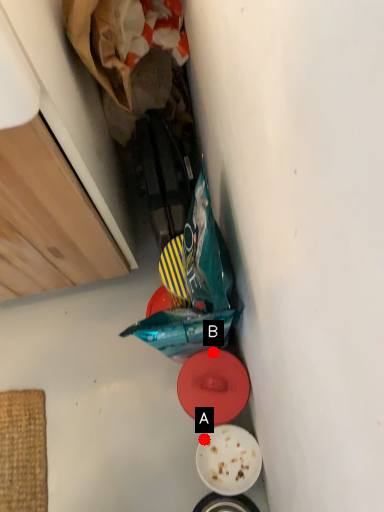
Question: Two points are circled on the image, labeled by A and B beside each circle. Among these points, which one is nearest to the camera?

Choices:
 (A) A is closer
 (B) B is closer

Answer: (B)